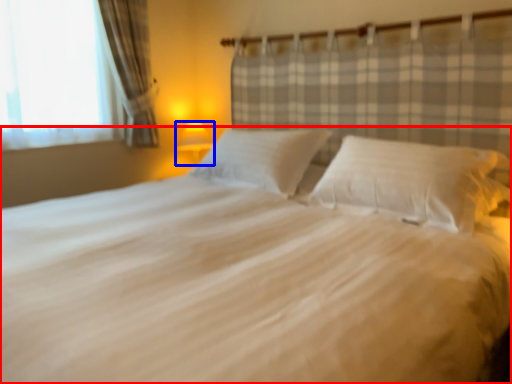
Question: Which of the following is the closest to the observer, bed (highlighted by a red box) or lamp (highlighted by a blue box)?

Choices:
 (A) bed
 (B) lamp

Answer: (A)